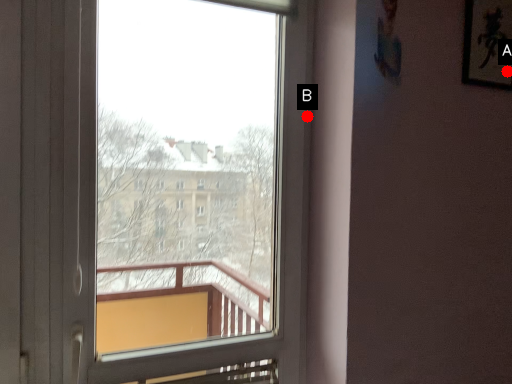
Question: Two points are circled on the image, labeled by A and B beside each circle. Among these points, which one is nearest to the camera?

Choices:
 (A) A is closer
 (B) B is closer

Answer: (B)